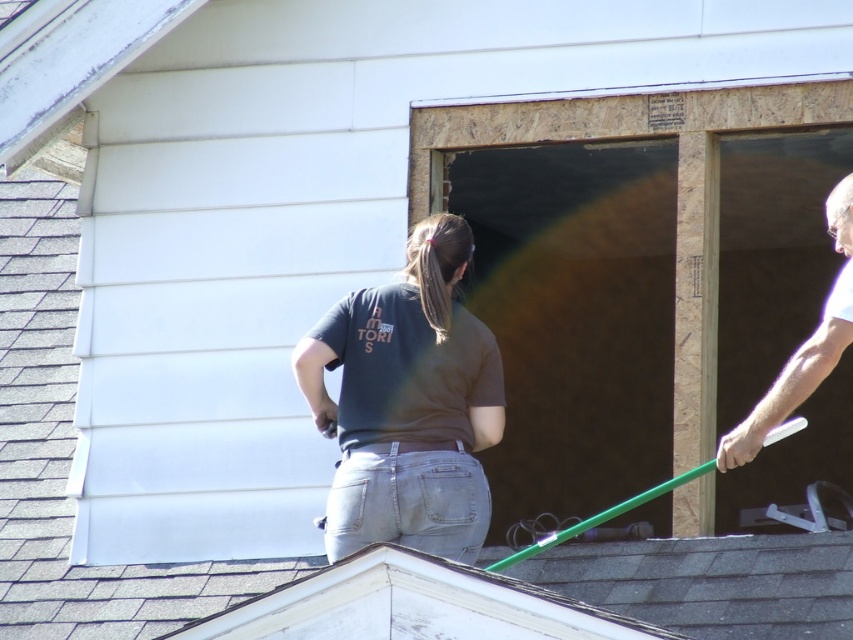
Question: From the image, what is the correct spatial relationship of dark gray t-shirt at center in relation to smooth white arm at upper right?

Choices:
 (A) below
 (B) above

Answer: (A)

Question: Is dark gray t-shirt at center smaller than smooth white arm at upper right?

Choices:
 (A) no
 (B) yes

Answer: (B)

Question: Which object is closer to the camera taking this photo?

Choices:
 (A) dark gray t-shirt at center
 (B) smooth white arm at upper right

Answer: (B)

Question: Does dark gray t-shirt at center have a lesser width compared to smooth white arm at upper right?

Choices:
 (A) no
 (B) yes

Answer: (B)